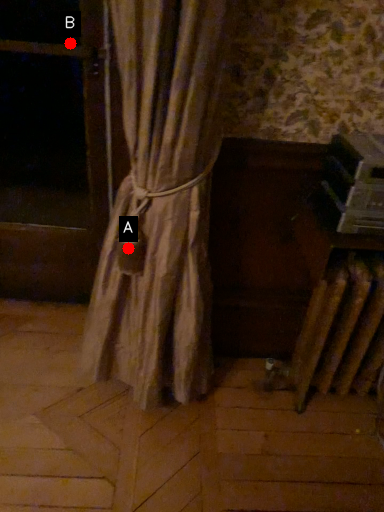
Question: Two points are circled on the image, labeled by A and B beside each circle. Which of the following is the closest to the observer?

Choices:
 (A) A is closer
 (B) B is closer

Answer: (A)